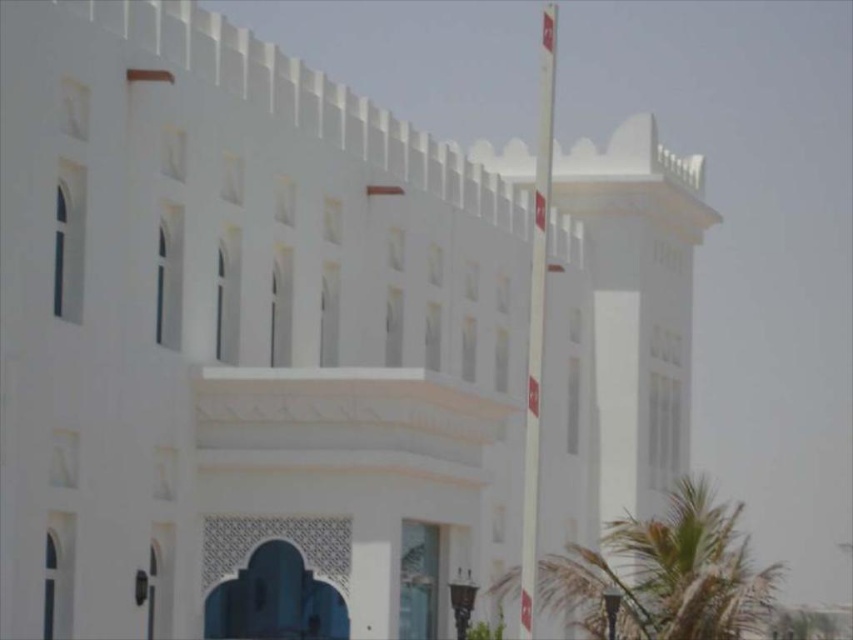
Who is higher up, green leafy palm tree at lower right or white plastic flag pole at right?

Positioned higher is white plastic flag pole at right.

Which is more to the right, green leafy palm tree at lower right or white plastic flag pole at right?

green leafy palm tree at lower right

Which is behind, point (704, 509) or point (554, 48)?

The point (554, 48) is more distant.

You are a GUI agent. You are given a task and a screenshot of the screen. Output one action in this format:
    pyautogui.click(x=<x>, y=<y>)
    Task: Click on the green leafy palm tree at lower right
    
    Given the screenshot: What is the action you would take?
    pyautogui.click(x=663, y=573)